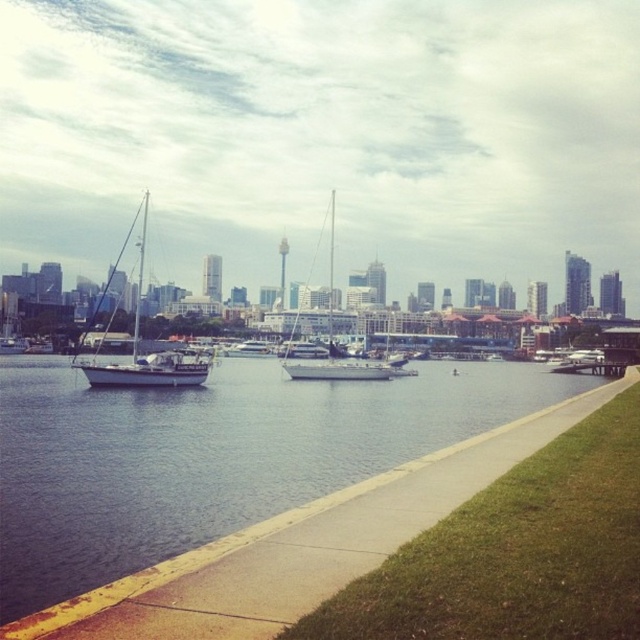
Question: Is concrete sidewalk at lower center bigger than white matte boat at center?

Choices:
 (A) yes
 (B) no

Answer: (A)

Question: Is white glossy sailboat at left positioned before white matte sailboat at center?

Choices:
 (A) yes
 (B) no

Answer: (A)

Question: Which of the following is the farthest from the observer?

Choices:
 (A) white matte sailboat at center
 (B) white glossy sailboat at left
 (C) concrete sidewalk at lower center

Answer: (A)

Question: Considering the relative positions of white glossy sailboat at left and white matte sailboat at center in the image provided, where is white glossy sailboat at left located with respect to white matte sailboat at center?

Choices:
 (A) above
 (B) below

Answer: (A)

Question: Which of the following is the closest to the observer?

Choices:
 (A) white matte sailboat at center
 (B) white glossy sailboat at left
 (C) concrete sidewalk at lower center
 (D) white matte boat at center

Answer: (C)

Question: Which object is positioned closest to the white matte sailboat at center?

Choices:
 (A) concrete sidewalk at lower center
 (B) white glossy sailboat at left

Answer: (B)